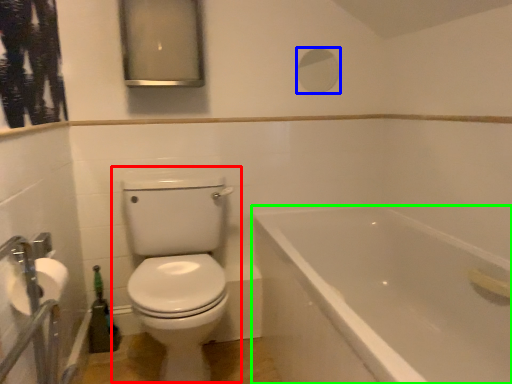
Question: Considering the real-world distances, which object is closest to toilet (highlighted by a red box)? mirror (highlighted by a blue box) or bathtub (highlighted by a green box).

Choices:
 (A) mirror
 (B) bathtub

Answer: (B)